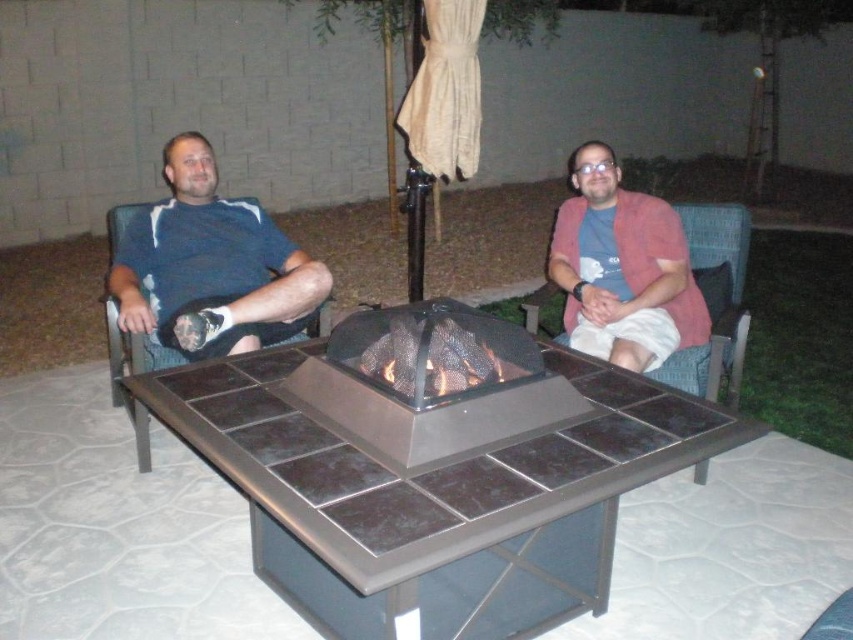
Is point (468, 372) closer to viewer compared to point (148, 307)?

Yes.

You are a GUI agent. You are given a task and a screenshot of the screen. Output one action in this format:
    pyautogui.click(x=<x>, y=<y>)
    Task: Click on the metallic silver fire pit at center
    The image size is (853, 640).
    Given the screenshot: What is the action you would take?
    pyautogui.click(x=433, y=381)

Identify the location of metallic silver fire pit at center. This screenshot has width=853, height=640. (433, 381).

Consider the image. Is metallic slate table at center smaller than woven fabric chair at right?

No, metallic slate table at center is not smaller than woven fabric chair at right.

Between metallic slate table at center and woven fabric chair at right, which one is positioned higher?

woven fabric chair at right is higher up.

Image resolution: width=853 pixels, height=640 pixels. I want to click on metallic slate table at center, so click(x=434, y=497).

Does metallic silver fire pit at center lie behind pink fabric jacket at right?

No, metallic silver fire pit at center is closer to the viewer.

Based on the photo, is metallic silver fire pit at center to the left of pink fabric jacket at right from the viewer's perspective?

Indeed, metallic silver fire pit at center is positioned on the left side of pink fabric jacket at right.

Is point (482, 397) farther from camera compared to point (654, 321)?

No, (482, 397) is in front of (654, 321).

Identify the location of metallic silver fire pit at center. The height and width of the screenshot is (640, 853). (433, 381).